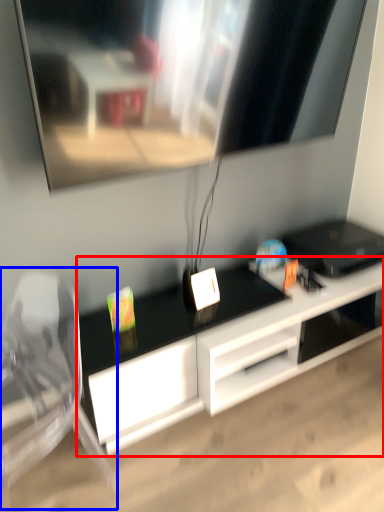
Question: Among these objects, which one is farthest to the camera, desk (highlighted by a red box) or swivel chair (highlighted by a blue box)?

Choices:
 (A) desk
 (B) swivel chair

Answer: (A)